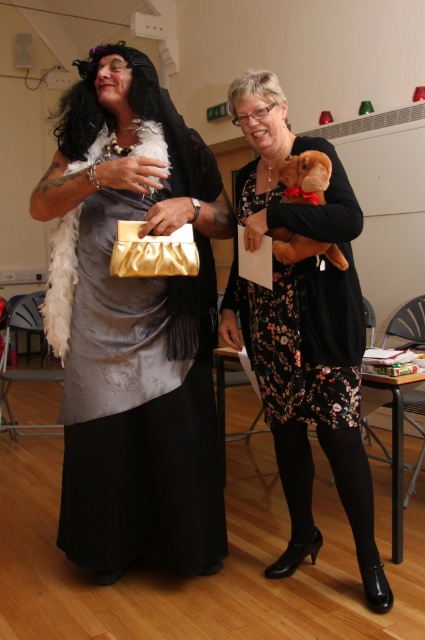
You are organizing a purse display and need to know which object is wider between the satin gold clutch at center and the floral dress at center. Can you determine which one is wider?

The satin gold clutch at center is wider than the floral dress at center according to the description.

You are organizing a small event and need to place both the satin gold clutch at center and the brown plush toy at center on a shelf. The shelf has a weight limit of 1.5 kilograms. The clutch weighs 0.8 kilograms and the plush toy weighs 0.6 kilograms. Can both items be placed on the shelf together without exceeding the weight limit?

The total weight of the satin gold clutch at center and the brown plush toy at center is 1.4 kilograms, which is under the 1.5 kilograms limit. Therefore, both items can be placed on the shelf together.

You are at a party and want to take a photo of both the person in the elaborate costume and the person with the stuffed dog toy. You notice two specific points in the scene marked as point 1 at coordinates point (x=269, y=321) and point 2 at coordinates point (x=297, y=244). Which point should you focus on to ensure both subjects are in sharp focus?

Point 1 at coordinates point (x=269, y=321) is closer to the viewer than point 2 at coordinates point (x=297, y=244). Therefore, focusing on point 1 will ensure both subjects are in sharp focus since it is the closer point.